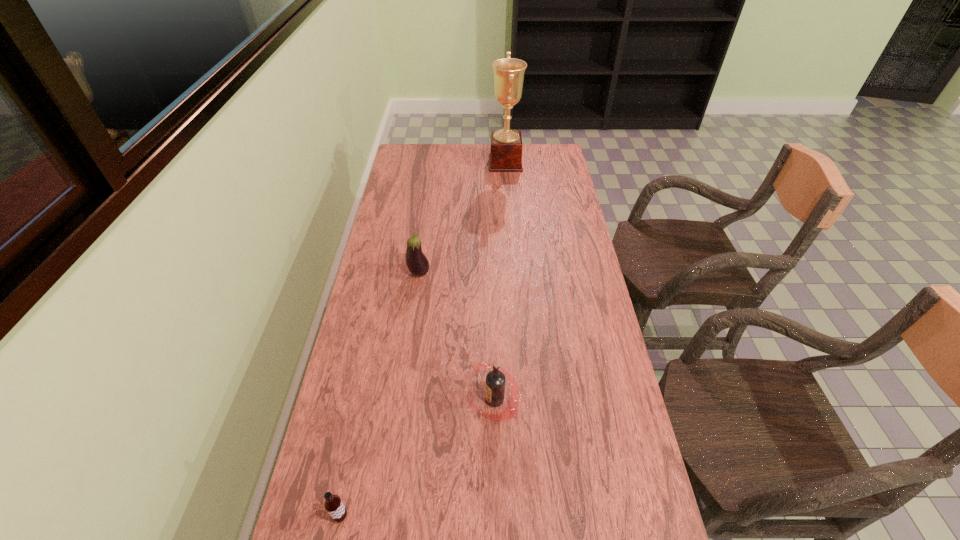
I want to click on free spot at the left edge of the desktop, so click(x=373, y=462).

Identify the location of vacant space at the right edge. (544, 239).

This screenshot has height=540, width=960. Find the location of `free region at the far left corner of the desktop`. free region at the far left corner of the desktop is located at coordinates (431, 145).

The image size is (960, 540). In the image, there is a desktop. Find the location of `vacant space at the far right corner`. vacant space at the far right corner is located at coordinates (548, 146).

This screenshot has height=540, width=960. I want to click on vacant space in between the second farthest object and the shortest object, so click(380, 395).

Identify the location of free space between the farther root beer and the farthest object. This screenshot has width=960, height=540. (500, 281).

Where is `vacant area that lies between the nearer root beer and the third nearest object`? Image resolution: width=960 pixels, height=540 pixels. vacant area that lies between the nearer root beer and the third nearest object is located at coordinates pos(380,395).

Find the location of a particular element. This screenshot has width=960, height=540. unoccupied position between the nearest object and the second object from left to right is located at coordinates 380,395.

The image size is (960, 540). Find the location of `vacant area that lies between the farthest object and the taller root beer`. vacant area that lies between the farthest object and the taller root beer is located at coordinates tap(500, 281).

Where is `free space that is in between the shorter root beer and the taller root beer`? This screenshot has width=960, height=540. free space that is in between the shorter root beer and the taller root beer is located at coordinates (418, 458).